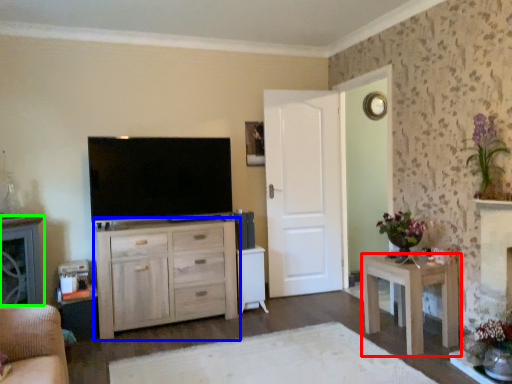
Question: Which object is the farthest from nightstand (highlighted by a red box)? Choose among these: chest of drawers (highlighted by a blue box) or cabinetry (highlighted by a green box).

Choices:
 (A) chest of drawers
 (B) cabinetry

Answer: (B)